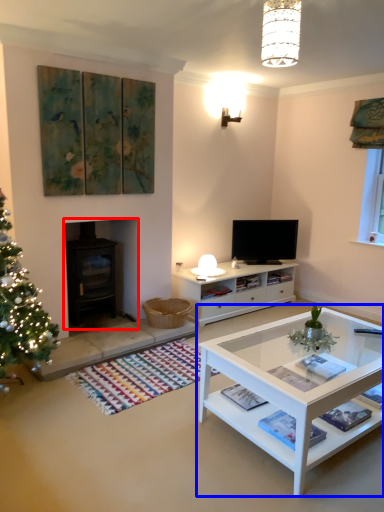
Question: Which point is further to the camera, fireplace (highlighted by a red box) or coffee table (highlighted by a blue box)?

Choices:
 (A) fireplace
 (B) coffee table

Answer: (A)